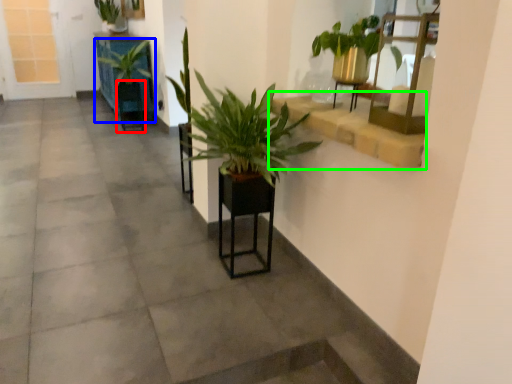
Question: Based on their relative distances, which object is farther from armchair (highlighted by a red box)? Choose from houseplant (highlighted by a blue box) and window sill (highlighted by a green box).

Choices:
 (A) houseplant
 (B) window sill

Answer: (B)